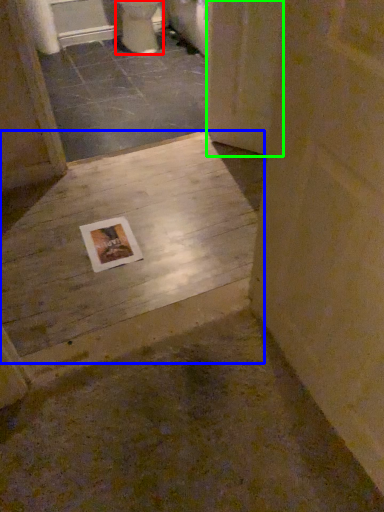
Question: Based on their relative distances, which object is farther from toilet (highlighted by a red box)? Choose from concrete (highlighted by a blue box) and screen door (highlighted by a green box).

Choices:
 (A) concrete
 (B) screen door

Answer: (A)